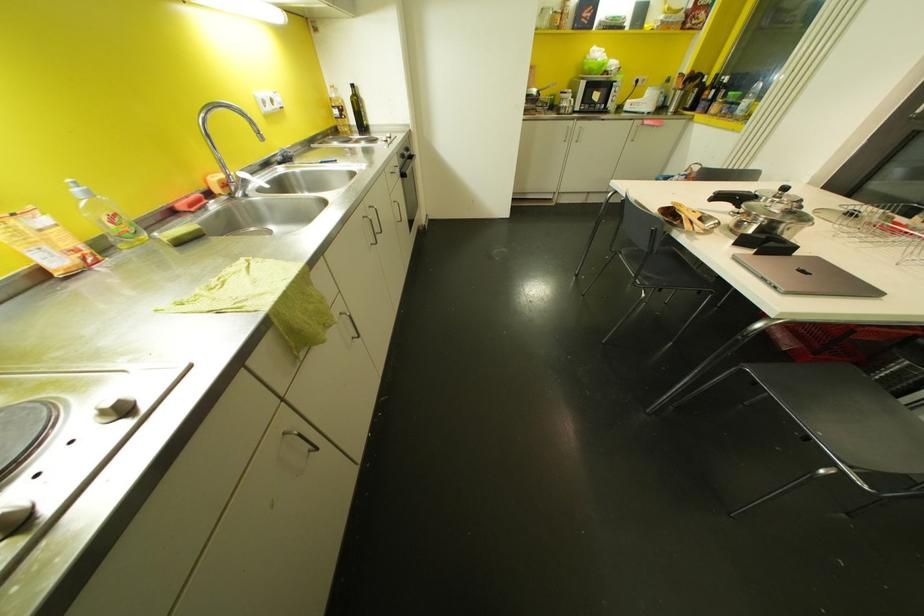
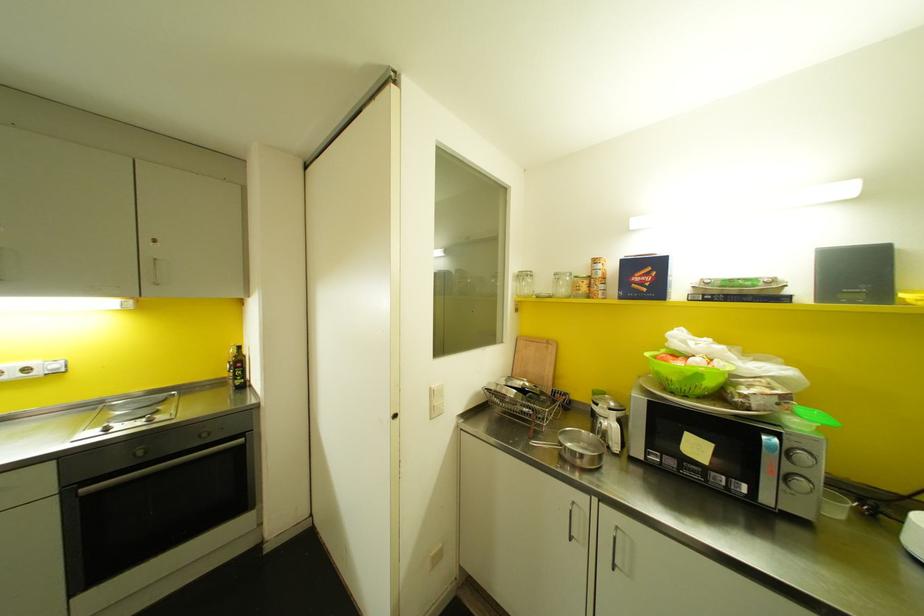
In the second image, find the point that corresponds to [557,26] in the first image.

(588, 294)